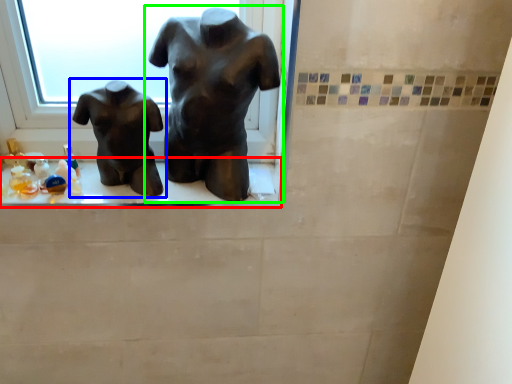
Question: Which object is positioned closest to window sill (highlighted by a red box)? Select from statue (sculpture) (highlighted by a blue box) and statue (sculpture) (highlighted by a green box).

Choices:
 (A) statue (sculpture)
 (B) statue (sculpture)

Answer: (A)